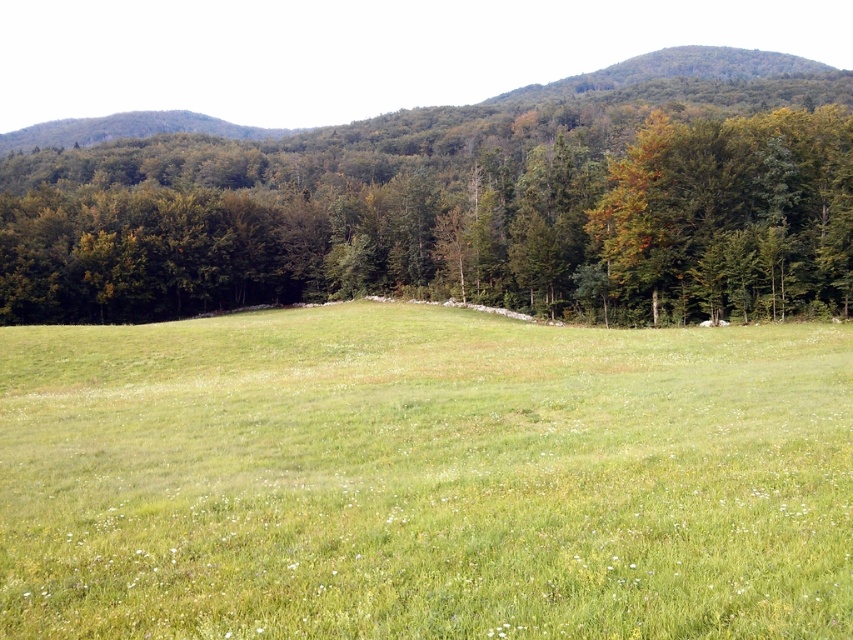
Looking at this image, you are standing at the point marked as point [424,477] in the image. What is the immediate terrain you are standing on?

The immediate terrain at point [424,477] is the green grassy field at center.

You are standing in the middle of the green grassy field at center and want to walk towards the green leafy tree at center. In which direction should you head?

The green grassy field at center is positioned on the left side of the green leafy tree at center, so you should head to the right to walk towards the green leafy tree at center.